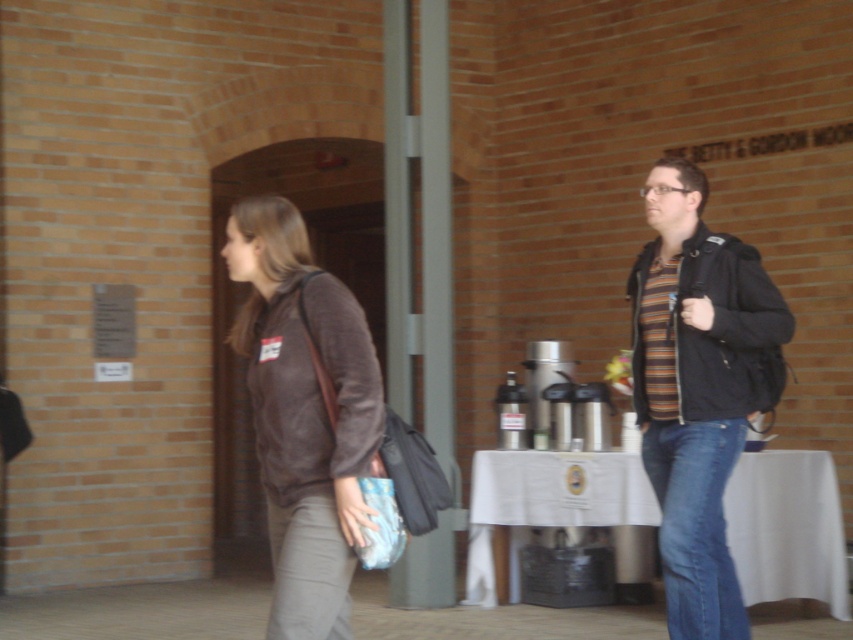
Question: Is striped knit sweater at center further to the viewer compared to brown suede jacket at left?

Choices:
 (A) no
 (B) yes

Answer: (B)

Question: Estimate the real-world distances between objects in this image. Which object is farther from the striped knit sweater at center?

Choices:
 (A) brown suede jacket at left
 (B) white cloth-covered table at lower center

Answer: (B)

Question: Considering the real-world distances, which object is closest to the brown suede jacket at left?

Choices:
 (A) striped knit sweater at center
 (B) white cloth-covered table at lower center

Answer: (A)

Question: Can you confirm if striped knit sweater at center is thinner than white cloth-covered table at lower center?

Choices:
 (A) no
 (B) yes

Answer: (B)

Question: Which point is closer to the camera?

Choices:
 (A) (703, 342)
 (B) (741, 490)
 (C) (258, 339)

Answer: (C)

Question: Is striped knit sweater at center above white cloth-covered table at lower center?

Choices:
 (A) no
 (B) yes

Answer: (B)